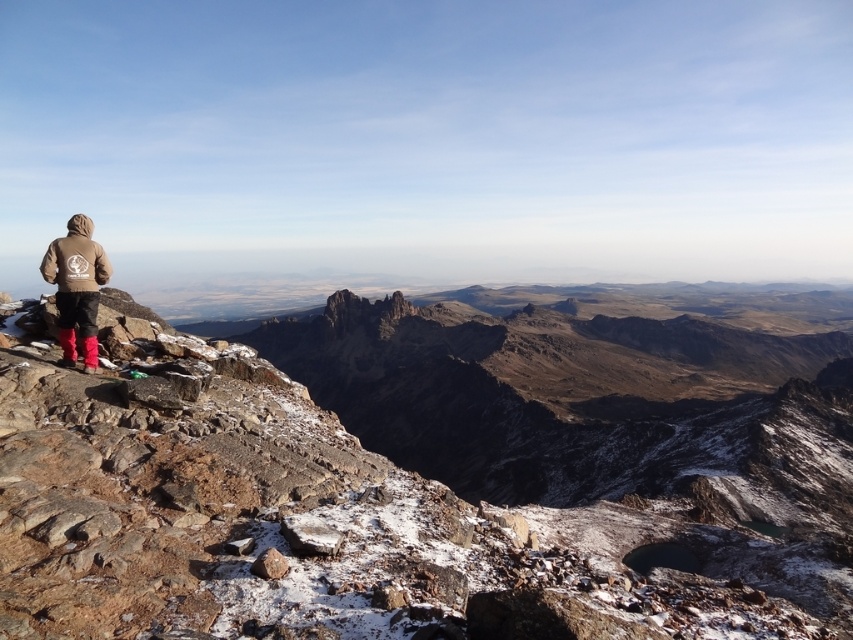
Question: Among these points, which one is nearest to the camera?

Choices:
 (A) 57,276
 (B) 192,524

Answer: (B)

Question: Which point is farther to the camera?

Choices:
 (A) brown rocky mountain at left
 (B) brown suede jacket at lower left

Answer: (B)

Question: Can you confirm if brown rocky mountain at left is smaller than brown suede jacket at lower left?

Choices:
 (A) no
 (B) yes

Answer: (A)

Question: Among these objects, which one is farthest from the camera?

Choices:
 (A) brown suede jacket at lower left
 (B) brown rocky mountain at left

Answer: (A)

Question: Does brown rocky mountain at left have a larger size compared to brown suede jacket at lower left?

Choices:
 (A) yes
 (B) no

Answer: (A)

Question: Does brown rocky mountain at left appear on the right side of brown suede jacket at lower left?

Choices:
 (A) yes
 (B) no

Answer: (B)